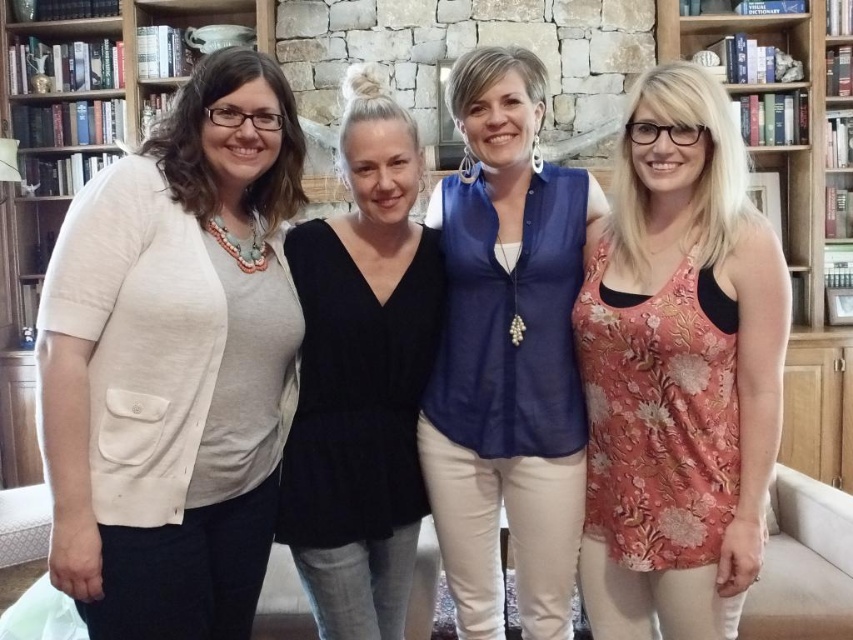
Question: Which point is farther to the camera?

Choices:
 (A) (819, 3)
 (B) (254, 396)
 (C) (624, 563)

Answer: (A)

Question: Is floral fabric tank top at right above wooden bookshelf at right?

Choices:
 (A) no
 (B) yes

Answer: (A)

Question: Is floral fabric tank top at right closer to the viewer compared to wooden bookshelf at right?

Choices:
 (A) no
 (B) yes

Answer: (B)

Question: Is blue sheer blouse at center wider than wooden bookshelf at right?

Choices:
 (A) yes
 (B) no

Answer: (B)

Question: Which of the following is the farthest from the observer?

Choices:
 (A) (132, 205)
 (B) (28, 326)
 (C) (720, 161)

Answer: (B)

Question: Which object is farther from the camera taking this photo?

Choices:
 (A) matte beige cardigan at left
 (B) wooden bookshelf at right

Answer: (B)